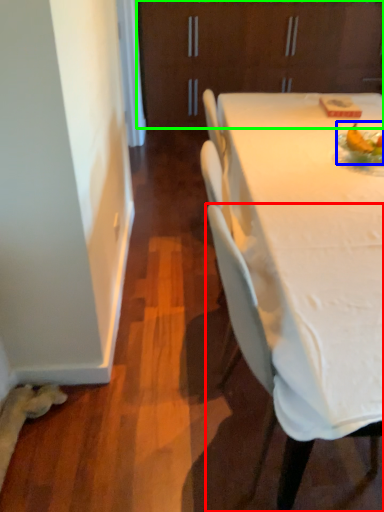
Question: Based on their relative distances, which object is nearer to chair (highlighted by a red box)? Choose from food (highlighted by a blue box) and cabinetry (highlighted by a green box).

Choices:
 (A) food
 (B) cabinetry

Answer: (A)